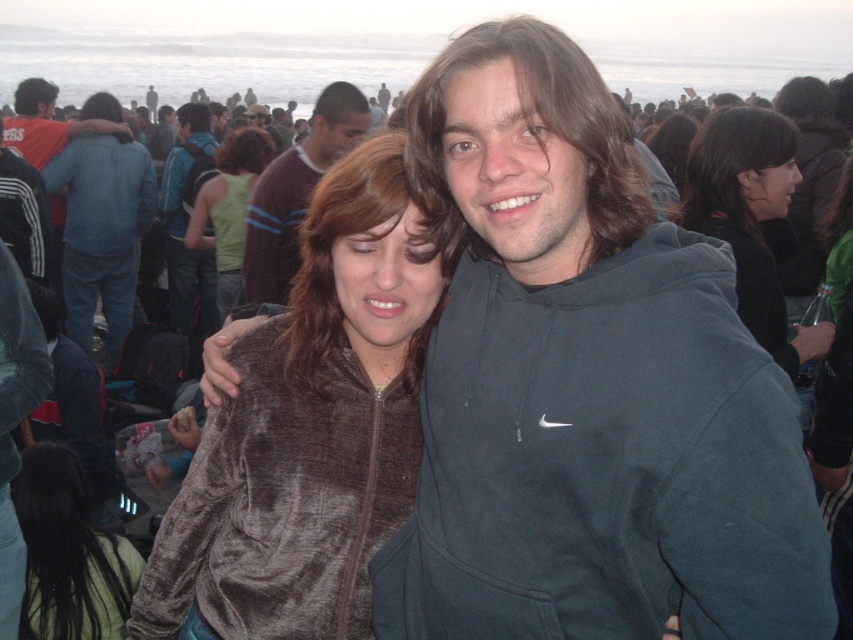
Question: Does velvet brown hoodie at center have a larger size compared to velvet brown jacket at lower left?

Choices:
 (A) yes
 (B) no

Answer: (A)

Question: Which object is positioned closest to the dark brown sweater at center?

Choices:
 (A) velvet brown jacket at lower left
 (B) blue denim jeans at left
 (C) green jersey at center

Answer: (C)

Question: Which object is farther from the camera taking this photo?

Choices:
 (A) dark brown sweater at center
 (B) velvet brown hoodie at center
 (C) black velvet jacket at upper right
 (D) velvet brown jacket at lower left

Answer: (A)

Question: Can you confirm if black velvet jacket at upper right is thinner than velvet brown jacket at lower left?

Choices:
 (A) yes
 (B) no

Answer: (B)

Question: Can you confirm if velvet brown hoodie at center is positioned to the left of green jersey at center?

Choices:
 (A) yes
 (B) no

Answer: (B)

Question: Which of these objects is positioned closest to the velvet brown hoodie at center?

Choices:
 (A) green jersey at center
 (B) dark brown sweater at center
 (C) velvet brown jacket at lower left

Answer: (C)